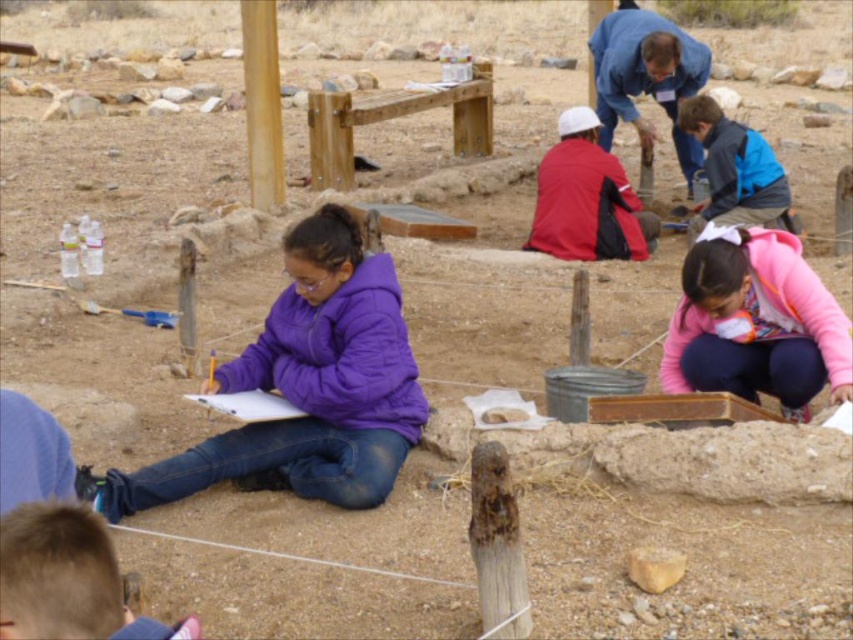
Between purple fleece jacket at center and red matte jacket at center, which one is positioned higher?

red matte jacket at center is higher up.

Is point (106, 480) farther from camera compared to point (567, 208)?

No, (106, 480) is closer to viewer.

Find the location of a particular element. purple fleece jacket at center is located at coordinates (305, 387).

Is point (772, 380) more distant than point (740, 209)?

No.

From the picture: Who is more forward, (769, 260) or (706, 118)?

Positioned in front is point (769, 260).

You are a GUI agent. You are given a task and a screenshot of the screen. Output one action in this format:
    pyautogui.click(x=<x>, y=<y>)
    Task: Click on the pink fleece jacket at lower right
    This screenshot has height=640, width=853.
    Given the screenshot: What is the action you would take?
    pyautogui.click(x=755, y=323)

Does pink fleece jacket at lower right come in front of red matte jacket at center?

Yes, it is.

Identify the location of pink fleece jacket at lower right. This screenshot has height=640, width=853. 755,323.

Where is `pink fleece jacket at lower right`? This screenshot has height=640, width=853. pink fleece jacket at lower right is located at coordinates (755, 323).